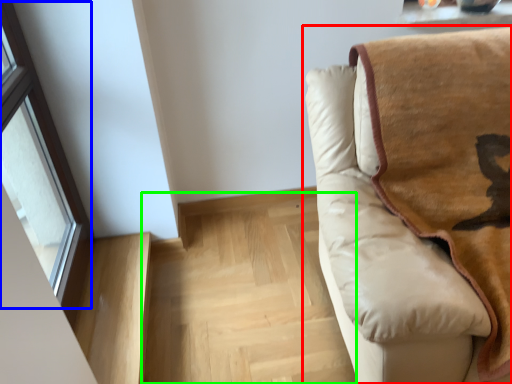
Question: Estimate the real-world distances between objects in this image. Which object is closer to studio couch (highlighted by a red box), window (highlighted by a blue box) or stairwell (highlighted by a green box)?

Choices:
 (A) window
 (B) stairwell

Answer: (B)